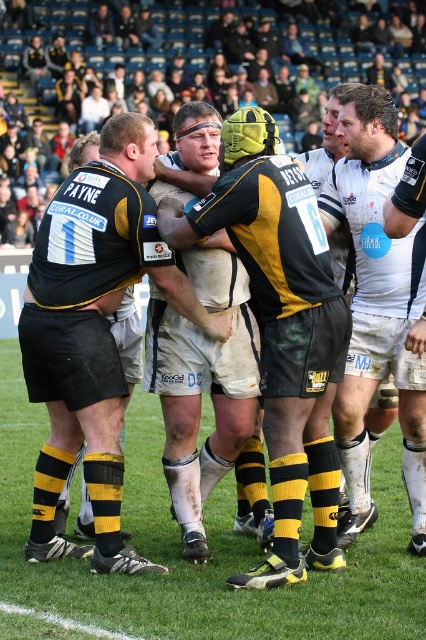
Is yellow and black rugby jersey at center thinner than white jersey at center?

Incorrect, yellow and black rugby jersey at center's width is not less than white jersey at center's.

Is yellow and black rugby jersey at center below white jersey at center?

Indeed, yellow and black rugby jersey at center is positioned under white jersey at center.

Find the location of a particular element. The width and height of the screenshot is (426, 640). yellow and black rugby jersey at center is located at coordinates (282, 330).

Locate an element on the screen. The width and height of the screenshot is (426, 640). black matte jersey at center is located at coordinates (94, 326).

Who is higher up, black matte jersey at center or white jersey at center?

white jersey at center is above.

Is point (108, 516) positioned after point (416, 465)?

No, (108, 516) is in front of (416, 465).

I want to click on black matte jersey at center, so click(x=94, y=326).

Can you confirm if black matte jersey at center is positioned to the right of yellow and black rugby jersey at center?

Incorrect, black matte jersey at center is not on the right side of yellow and black rugby jersey at center.

Does black matte jersey at center have a lesser width compared to yellow and black rugby jersey at center?

Incorrect, black matte jersey at center's width is not less than yellow and black rugby jersey at center's.

Locate an element on the screen. black matte jersey at center is located at coordinates pos(94,326).

What are the coordinates of `black matte jersey at center` in the screenshot? It's located at (94, 326).